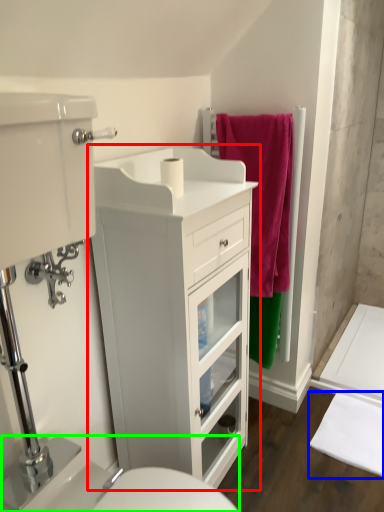
Question: Based on their relative distances, which object is nearer to bathroom cabinet (highlighted by a red box)? Choose from bath mat (highlighted by a blue box) and sink (highlighted by a green box).

Choices:
 (A) bath mat
 (B) sink

Answer: (B)